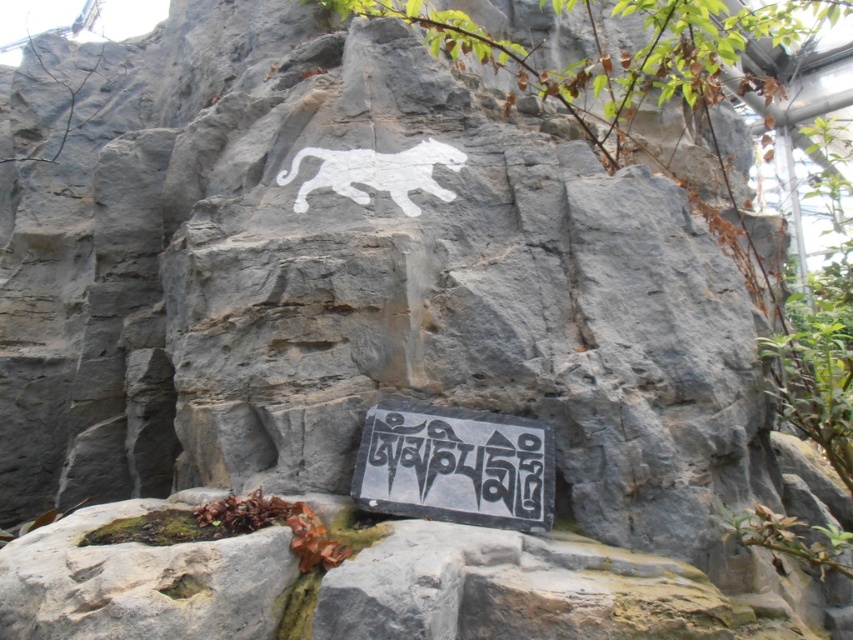
Is the position of black stone sign at lower center less distant than that of white painted tiger at center?

Yes, black stone sign at lower center is in front of white painted tiger at center.

Who is more distant from viewer, [357,493] or [412,160]?

Point [412,160]

Which is in front, point (383, 451) or point (386, 163)?

Point (383, 451) is in front.

The height and width of the screenshot is (640, 853). What are the coordinates of `black stone sign at lower center` in the screenshot? It's located at (456, 467).